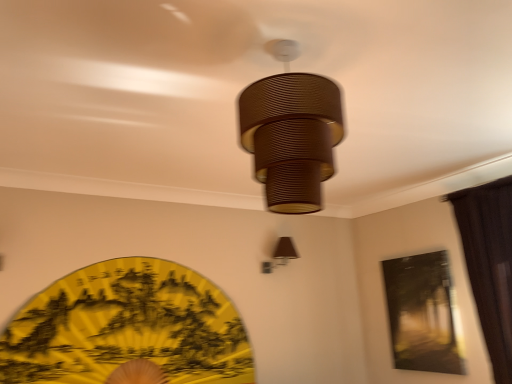
Question: Is the position of brown fabric curtain at right more distant than that of brown ribbed lampshade at center, marked as the second lamp in a back-to-front arrangement?

Choices:
 (A) no
 (B) yes

Answer: (B)

Question: Is brown ribbed lampshade at center, placed as the first lamp when sorted from top to bottom, surrounded by brown fabric curtain at right?

Choices:
 (A) yes
 (B) no

Answer: (B)

Question: Is brown fabric curtain at right oriented away from brown ribbed lampshade at center, acting as the second lamp starting from the bottom?

Choices:
 (A) no
 (B) yes

Answer: (A)

Question: From a real-world perspective, does brown fabric curtain at right stand above brown ribbed lampshade at center, marked as the second lamp in a back-to-front arrangement?

Choices:
 (A) no
 (B) yes

Answer: (A)

Question: Are brown fabric curtain at right and brown ribbed lampshade at center, marked as the second lamp in a back-to-front arrangement, making contact?

Choices:
 (A) no
 (B) yes

Answer: (A)

Question: In the image, is matte black painting at upper right positioned in front of or behind brown fabric curtain at right?

Choices:
 (A) behind
 (B) front

Answer: (A)

Question: Is matte black painting at upper right to the left or to the right of brown fabric curtain at right in the image?

Choices:
 (A) right
 (B) left

Answer: (B)

Question: From a real-world perspective, relative to brown fabric curtain at right, is matte black painting at upper right vertically above or below?

Choices:
 (A) above
 (B) below

Answer: (B)

Question: From their relative heights in the image, would you say matte black painting at upper right is taller or shorter than brown fabric curtain at right?

Choices:
 (A) tall
 (B) short

Answer: (B)

Question: Considering the positions of brown fabric lampshade at upper right, arranged as the second lamp when viewed from the front, and yellow paper fan at lower left in the image, is brown fabric lampshade at upper right, arranged as the second lamp when viewed from the front, taller or shorter than yellow paper fan at lower left?

Choices:
 (A) tall
 (B) short

Answer: (B)

Question: Considering the relative positions of brown fabric lampshade at upper right, which ranks as the second lamp in top-to-bottom order, and yellow paper fan at lower left in the image provided, is brown fabric lampshade at upper right, which ranks as the second lamp in top-to-bottom order, to the left or to the right of yellow paper fan at lower left?

Choices:
 (A) right
 (B) left

Answer: (A)

Question: Is brown fabric lampshade at upper right, arranged as the second lamp when viewed from the front, bigger or smaller than yellow paper fan at lower left?

Choices:
 (A) small
 (B) big

Answer: (A)

Question: From the image's perspective, is brown fabric lampshade at upper right, arranged as the second lamp when viewed from the front, located above or below yellow paper fan at lower left?

Choices:
 (A) above
 (B) below

Answer: (A)

Question: Considering the positions of point (291, 183) and point (279, 263), is point (291, 183) closer or farther from the camera than point (279, 263)?

Choices:
 (A) farther
 (B) closer

Answer: (B)

Question: In terms of width, does brown ribbed lampshade at center, marked as the second lamp in a back-to-front arrangement, look wider or thinner when compared to brown fabric lampshade at upper right, which ranks as the second lamp in top-to-bottom order?

Choices:
 (A) thin
 (B) wide

Answer: (B)